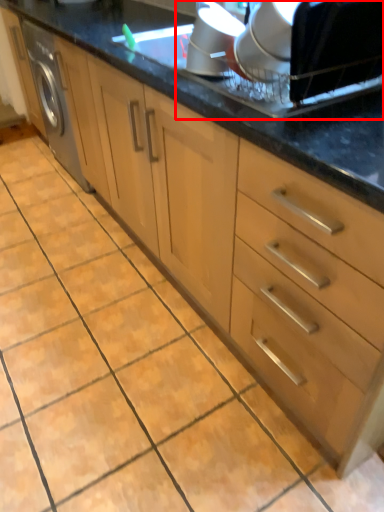
Question: From the image's perspective, where is appliance (annotated by the red box) located relative to appliance?

Choices:
 (A) below
 (B) above

Answer: (A)